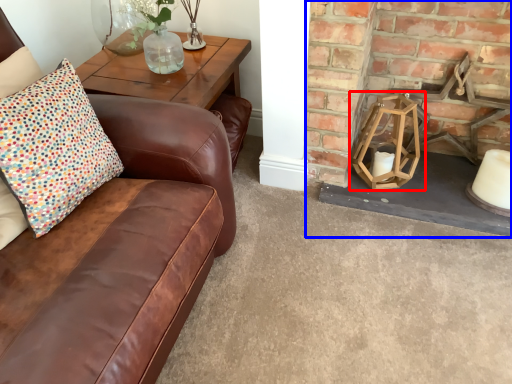
Question: Which point is closer to the camera, candle holder (highlighted by a red box) or fireplace (highlighted by a blue box)?

Choices:
 (A) candle holder
 (B) fireplace

Answer: (B)